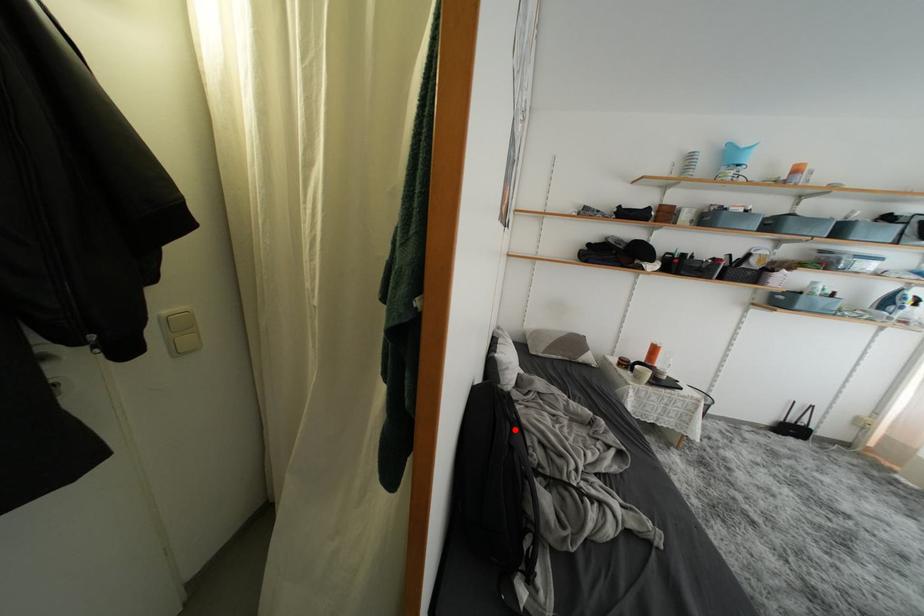
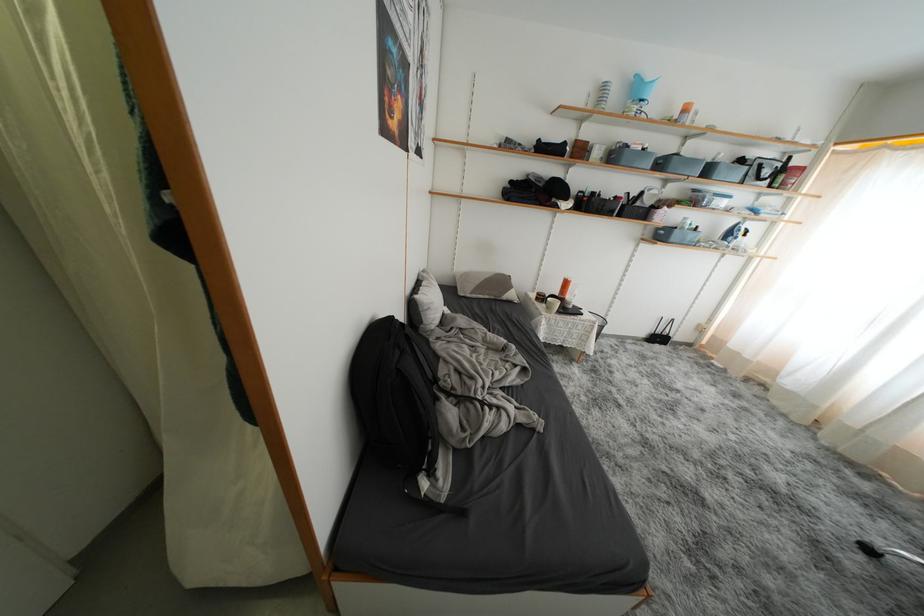
Question: I am providing you with two images of the same scene from different viewpoints. Image1 has a red point marked. In image2, the corresponding 3D location appears at what relative position? Reply with the corresponding letter.

Choices:
 (A) Closer
 (B) Farther

Answer: (A)